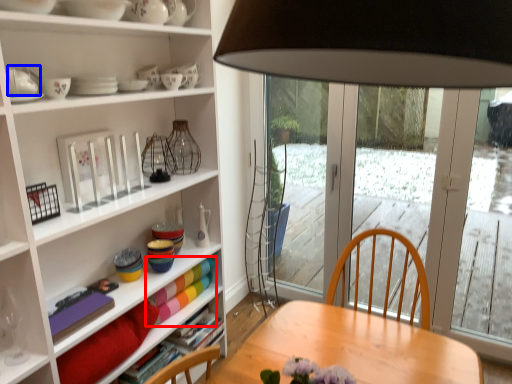
Question: Which point is closer to the camera, book (highlighted by a red box) or tableware (highlighted by a blue box)?

Choices:
 (A) book
 (B) tableware

Answer: (B)